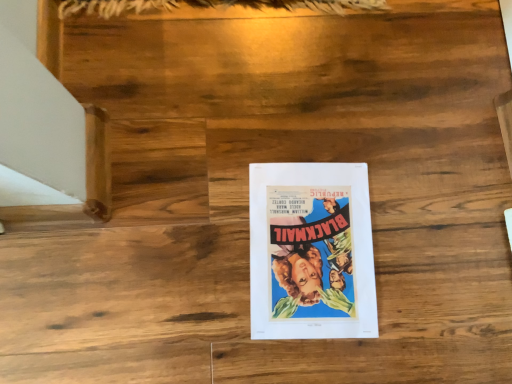
What do you see at coordinates (311, 251) in the screenshot? This screenshot has height=384, width=512. I see `vibrant paper poster at center` at bounding box center [311, 251].

Where is `vibrant paper poster at center`? This screenshot has width=512, height=384. vibrant paper poster at center is located at coordinates (311, 251).

What is the approximate height of vibrant paper poster at center?

vibrant paper poster at center is 0.45 inches tall.

You are a GUI agent. You are given a task and a screenshot of the screen. Output one action in this format:
    pyautogui.click(x=<x>, y=<y>)
    Task: Click on the vibrant paper poster at center
    
    Given the screenshot: What is the action you would take?
    pyautogui.click(x=311, y=251)